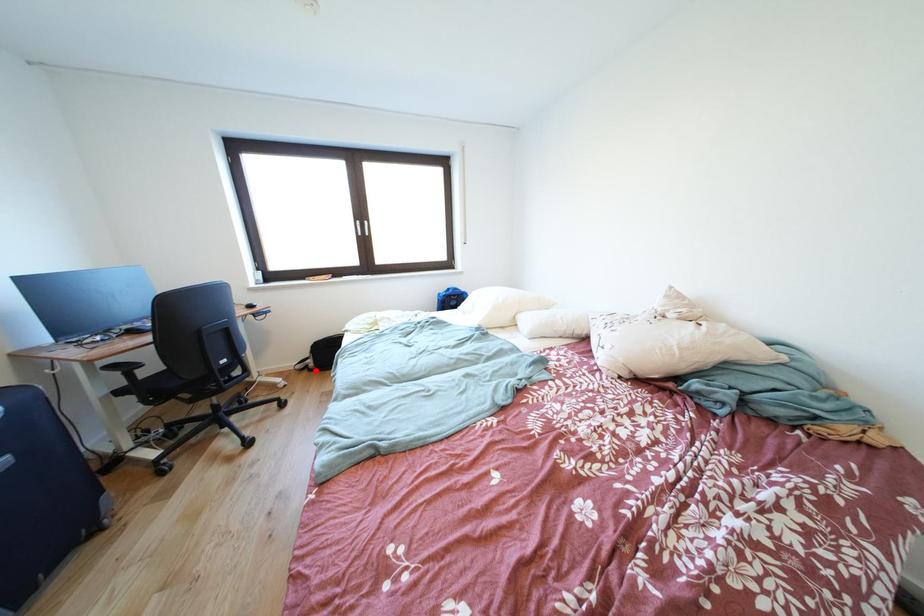
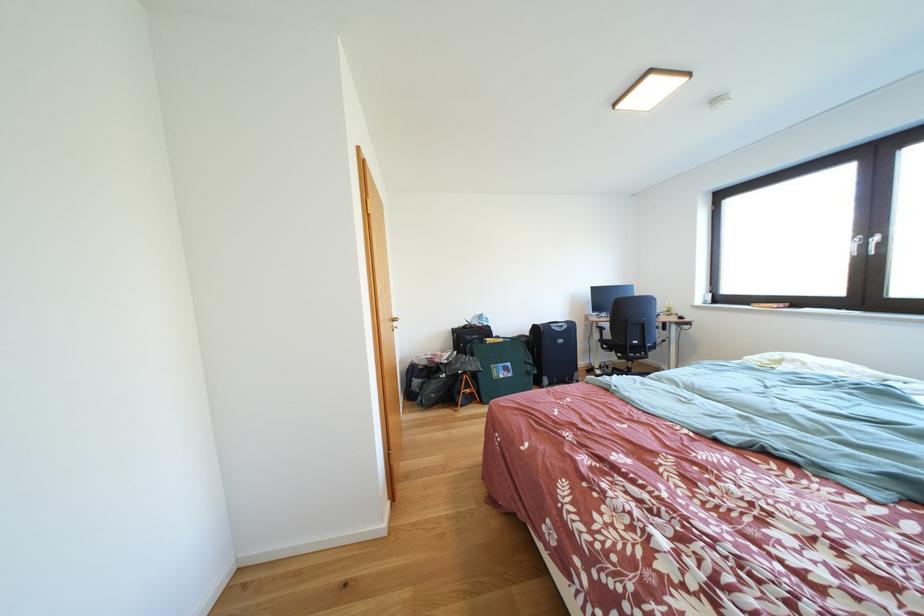
Question: I am providing you with two images of the same scene from different viewpoints. A red point is marked on the first image. Is the red point's position out of view in image 2?

Choices:
 (A) Yes
 (B) No

Answer: (A)